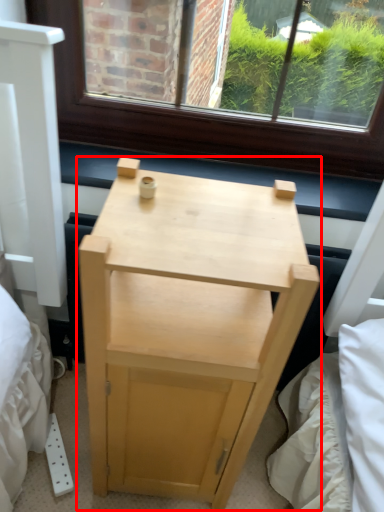
Question: Considering the relative positions of nightstand (annotated by the red box) and window sill in the image provided, where is nightstand (annotated by the red box) located with respect to the staircase?

Choices:
 (A) left
 (B) right

Answer: (A)